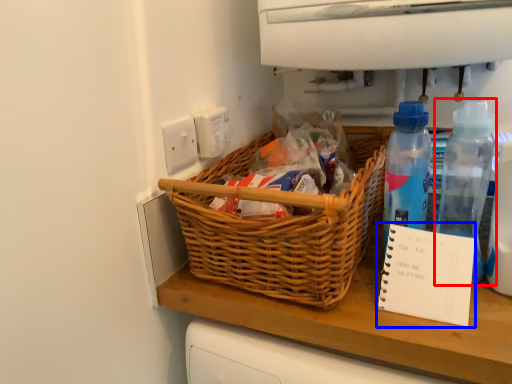
Question: Which point is closer to the camera, bottle (highlighted by a red box) or notebook (highlighted by a blue box)?

Choices:
 (A) bottle
 (B) notebook

Answer: (B)